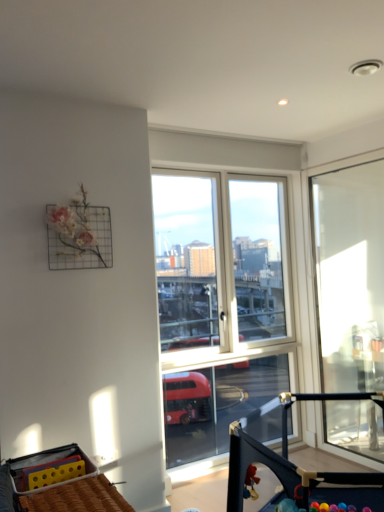
Question: Does black plastic baby carriage at center, arranged as the 1th baby carriage when viewed from the right, have a greater width compared to transparent glass door at right?

Choices:
 (A) no
 (B) yes

Answer: (B)

Question: Would you consider black plastic baby carriage at center, the 2th baby carriage when ordered from left to right, to be distant from transparent glass door at right?

Choices:
 (A) no
 (B) yes

Answer: (B)

Question: Does black plastic baby carriage at center, the 2th baby carriage when ordered from left to right, appear on the left side of transparent glass door at right?

Choices:
 (A) no
 (B) yes

Answer: (B)

Question: Is transparent glass door at right a part of black plastic baby carriage at center, the 2th baby carriage when ordered from left to right?

Choices:
 (A) no
 (B) yes

Answer: (A)

Question: Is black plastic baby carriage at center, arranged as the 1th baby carriage when viewed from the right, facing towards transparent glass door at right?

Choices:
 (A) yes
 (B) no

Answer: (B)

Question: In the image, is transparent glass door at right on the left side or the right side of yellow plastic baby carriage at lower left, arranged as the first baby carriage when viewed from the left?

Choices:
 (A) left
 (B) right

Answer: (B)

Question: Looking at their shapes, would you say transparent glass door at right is wider or thinner than yellow plastic baby carriage at lower left, arranged as the first baby carriage when viewed from the left?

Choices:
 (A) wide
 (B) thin

Answer: (B)

Question: Considering the positions of point (374, 174) and point (82, 495), is point (374, 174) closer or farther from the camera than point (82, 495)?

Choices:
 (A) farther
 (B) closer

Answer: (A)

Question: Considering the positions of transparent glass door at right and yellow plastic baby carriage at lower left, arranged as the first baby carriage when viewed from the left, in the image, is transparent glass door at right taller or shorter than yellow plastic baby carriage at lower left, arranged as the first baby carriage when viewed from the left,?

Choices:
 (A) short
 (B) tall

Answer: (B)

Question: Would you say transparent glass door at right is inside or outside black plastic baby carriage at center, arranged as the 1th baby carriage when viewed from the right?

Choices:
 (A) inside
 (B) outside

Answer: (B)

Question: From the image's perspective, is transparent glass door at right above or below black plastic baby carriage at center, the 2th baby carriage when ordered from left to right?

Choices:
 (A) below
 (B) above

Answer: (B)

Question: From a real-world perspective, relative to black plastic baby carriage at center, arranged as the 1th baby carriage when viewed from the right, is transparent glass door at right vertically above or below?

Choices:
 (A) below
 (B) above

Answer: (B)

Question: Is transparent glass door at right bigger or smaller than black plastic baby carriage at center, the 2th baby carriage when ordered from left to right?

Choices:
 (A) big
 (B) small

Answer: (B)

Question: Is black plastic baby carriage at center, the 2th baby carriage when ordered from left to right, situated inside yellow plastic baby carriage at lower left, arranged as the first baby carriage when viewed from the left, or outside?

Choices:
 (A) outside
 (B) inside

Answer: (A)

Question: In the image, is black plastic baby carriage at center, arranged as the 1th baby carriage when viewed from the right, on the left side or the right side of yellow plastic baby carriage at lower left, which is counted as the second baby carriage, starting from the right?

Choices:
 (A) left
 (B) right

Answer: (B)